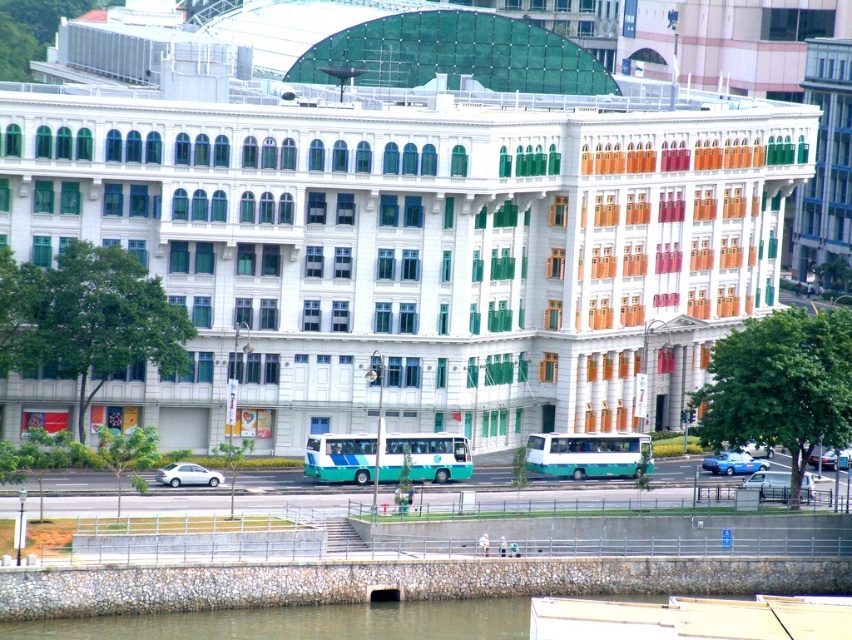
You are a delivery person needing to park your vehicle between the white matte sedan at lower left and the blue metallic car at lower right. Given that your van is 4 meters long, can you fit it in the space between them?

The white matte sedan at lower left is larger in size than the blue metallic car at lower right. However, without specific measurements of the space between them, it is impossible to determine if the van will fit. Please check the actual distance between the two vehicles.

You are standing in front of the building and want to take a photo. There are two points marked on the building facade at coordinates point (459, 480) and point (836, 460). Which point will appear larger in your photo?

Point (459, 480) is closer to the camera than point (836, 460), so it will appear larger in the photo.

You are a pedestrian standing on the sidewalk in front of the building. You see a teal glossy bus at center and a metallic silver car at center. Which vehicle is closer to you?

The teal glossy bus at center is closer to you because it is further to the viewer than the metallic silver car at center.